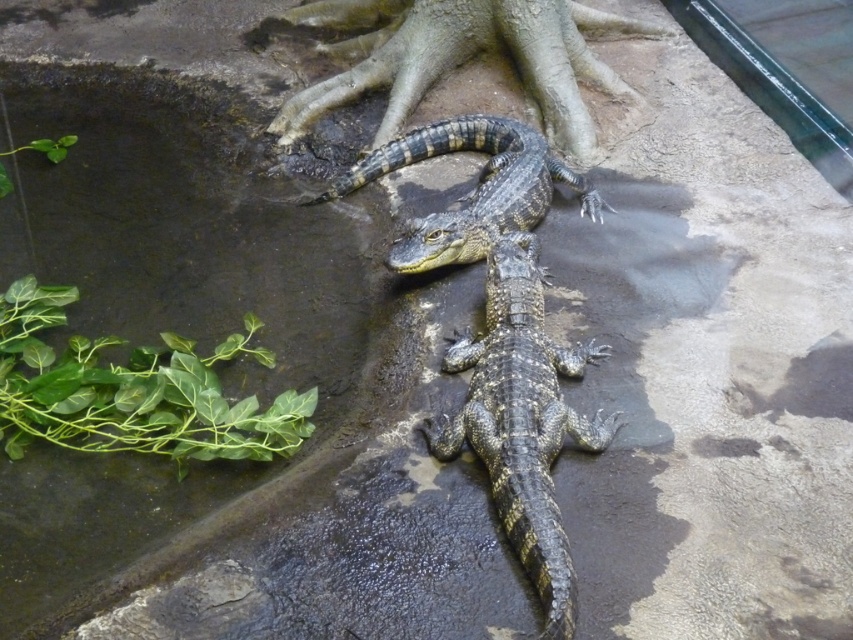
Question: Where is shiny black crocodile at center located in relation to shiny dark green crocodile at center in the image?

Choices:
 (A) below
 (B) above

Answer: (B)

Question: Which point is closer to the camera?

Choices:
 (A) shiny dark green crocodile at center
 (B) shiny black crocodile at center

Answer: (A)

Question: Which object appears farthest from the camera in this image?

Choices:
 (A) shiny dark green crocodile at center
 (B) shiny black crocodile at center

Answer: (B)

Question: Can you confirm if shiny black crocodile at center is positioned to the left of shiny dark green crocodile at center?

Choices:
 (A) no
 (B) yes

Answer: (B)

Question: Can you confirm if shiny black crocodile at center is bigger than shiny dark green crocodile at center?

Choices:
 (A) yes
 (B) no

Answer: (A)